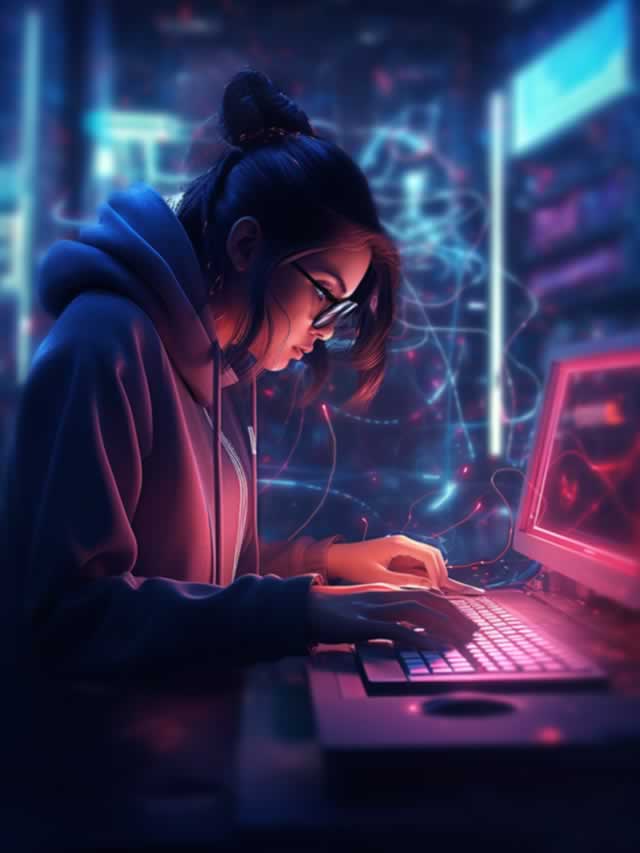
The image size is (640, 853). In order to click on cupholder space in this screenshot , I will do `click(461, 711)`.